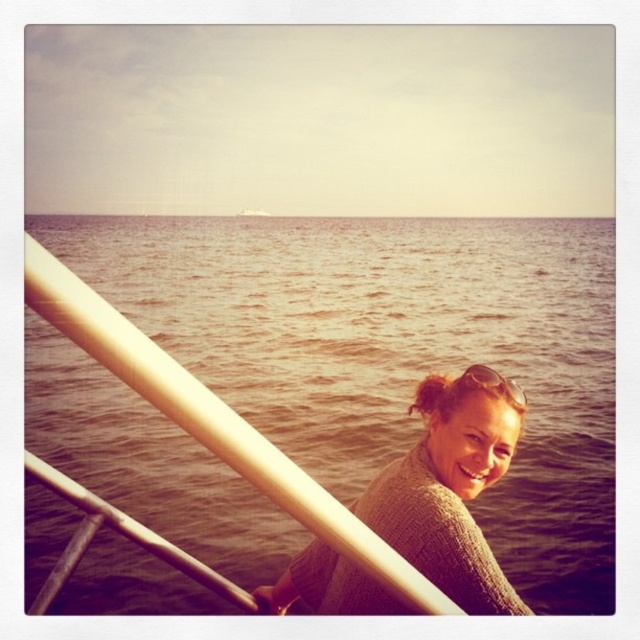
In the scene shown: Is knitted sweater at center in front of sunglasses at center?

Yes, it is in front of sunglasses at center.

Who is positioned more to the left, knitted sweater at center or sunglasses at center?

knitted sweater at center

Where is `knitted sweater at center`? This screenshot has width=640, height=640. knitted sweater at center is located at coordinates (451, 486).

Between brown water at center and knitted sweater at center, which one is positioned higher?

Positioned higher is brown water at center.

Locate an element on the screen. The image size is (640, 640). brown water at center is located at coordinates (394, 352).

Does point (160, 460) come behind point (486, 376)?

Yes, it is.

Locate an element on the screen. The height and width of the screenshot is (640, 640). brown water at center is located at coordinates (394, 352).

Can you confirm if brown water at center is positioned below sunglasses at center?

Actually, brown water at center is above sunglasses at center.

Can you confirm if brown water at center is shorter than sunglasses at center?

No, brown water at center is not shorter than sunglasses at center.

Who is more forward, (120, 547) or (490, 385)?

Point (490, 385)

This screenshot has height=640, width=640. I want to click on brown water at center, so click(x=394, y=352).